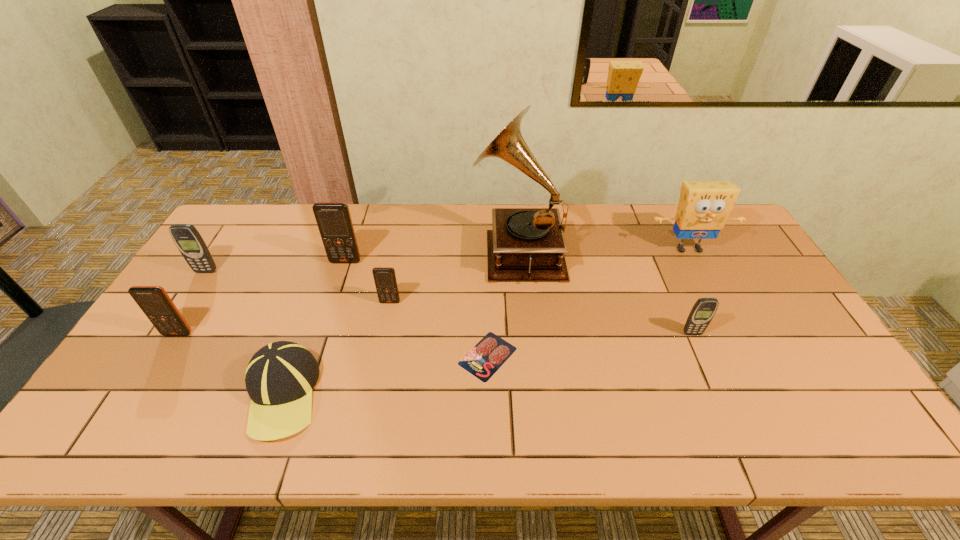
Identify the location of empty space between the sponge and the leftmost orange cellular telephone. This screenshot has width=960, height=540. (433, 291).

Locate an element on the screen. blank region between the eighth tallest object and the tallest object is located at coordinates (400, 322).

The height and width of the screenshot is (540, 960). In order to click on unoccupied position between the record player and the rightmost orange cellular telephone in this screenshot , I will do `click(454, 276)`.

This screenshot has width=960, height=540. In order to click on unoccupied position between the second shortest object and the salami in this screenshot , I will do `click(385, 375)`.

Locate an element on the screen. This screenshot has height=540, width=960. unoccupied area between the second farthest cellular telephone and the third cellular telephone from right to left is located at coordinates pyautogui.click(x=276, y=266).

Find the location of a particular element. The height and width of the screenshot is (540, 960). empty space between the bigger gray cellular telephone and the second farthest orange cellular telephone is located at coordinates (299, 287).

Identify the location of the third closest object to the tallest object. The width and height of the screenshot is (960, 540). (703, 208).

The width and height of the screenshot is (960, 540). Find the location of `object that stands as the closest to the second orange cellular telephone from right to left`. object that stands as the closest to the second orange cellular telephone from right to left is located at coordinates (385, 280).

Find the location of a particular element. The height and width of the screenshot is (540, 960). cellular telephone that is the third closest to the left gray cellular telephone is located at coordinates (385, 280).

Where is `cellular telephone object that ranks as the second closest to the second shortest object`? Image resolution: width=960 pixels, height=540 pixels. cellular telephone object that ranks as the second closest to the second shortest object is located at coordinates (153, 300).